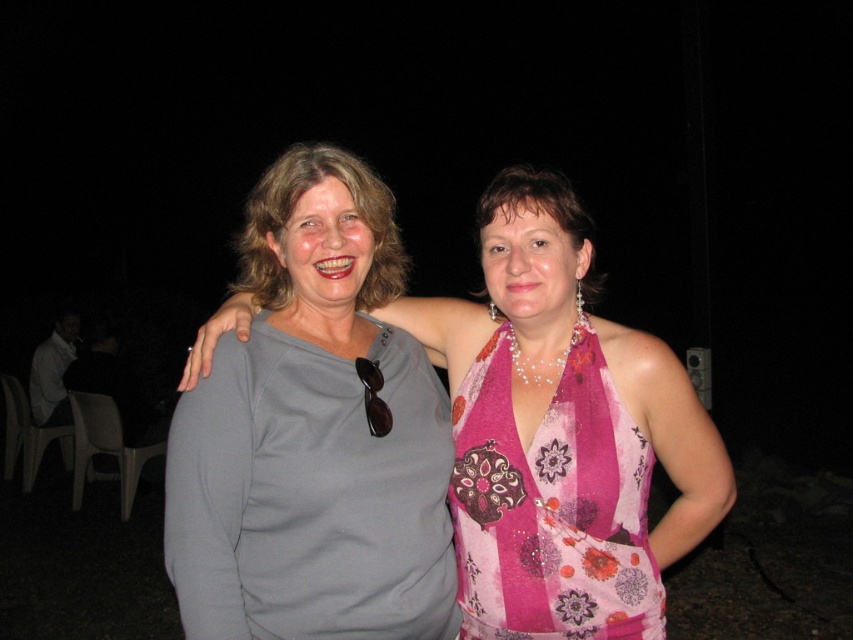
At what (x,y) coordinates should I click in order to perform the action: click on gray fabric shirt at center. Please return your answer as a coordinate pair (x, y). This screenshot has width=853, height=640. Looking at the image, I should click on (561, 433).

From the picture: Can you confirm if gray fabric shirt at center is bigger than pink floral fabric dress at center?

Indeed, gray fabric shirt at center has a larger size compared to pink floral fabric dress at center.

Is point (482, 531) closer to camera compared to point (469, 467)?

Yes, point (482, 531) is in front of point (469, 467).

Where is `gray fabric shirt at center`? Image resolution: width=853 pixels, height=640 pixels. gray fabric shirt at center is located at coordinates (561, 433).

Between matte gray shirt at center and pink floral fabric dress at center, which one has more height?

matte gray shirt at center

Describe the element at coordinates (314, 435) in the screenshot. I see `matte gray shirt at center` at that location.

Image resolution: width=853 pixels, height=640 pixels. What do you see at coordinates (314, 435) in the screenshot? I see `matte gray shirt at center` at bounding box center [314, 435].

This screenshot has height=640, width=853. In order to click on matte gray shirt at center in this screenshot , I will do `click(314, 435)`.

Measure the distance between matte gray shirt at center and camera.

matte gray shirt at center is 1.34 meters away from camera.

Is matte gray shirt at center to the left of gray fabric shirt at center from the viewer's perspective?

Indeed, matte gray shirt at center is positioned on the left side of gray fabric shirt at center.

Find the location of a particular element. matte gray shirt at center is located at coordinates (314, 435).

The width and height of the screenshot is (853, 640). Identify the location of matte gray shirt at center. (314, 435).